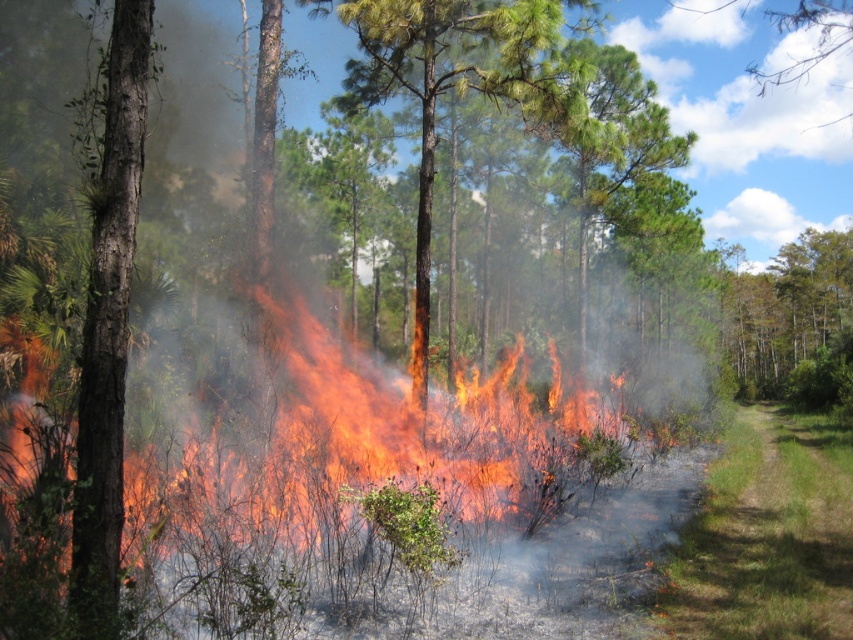
You are a firefighter assessing the fire spread in the forest. You notice the smooth bark tree at left and the green matte tree at upper right. Which tree is shorter in height?

The smooth bark tree at left is not as tall as the green matte tree at upper right, so the smooth bark tree at left is shorter in height.